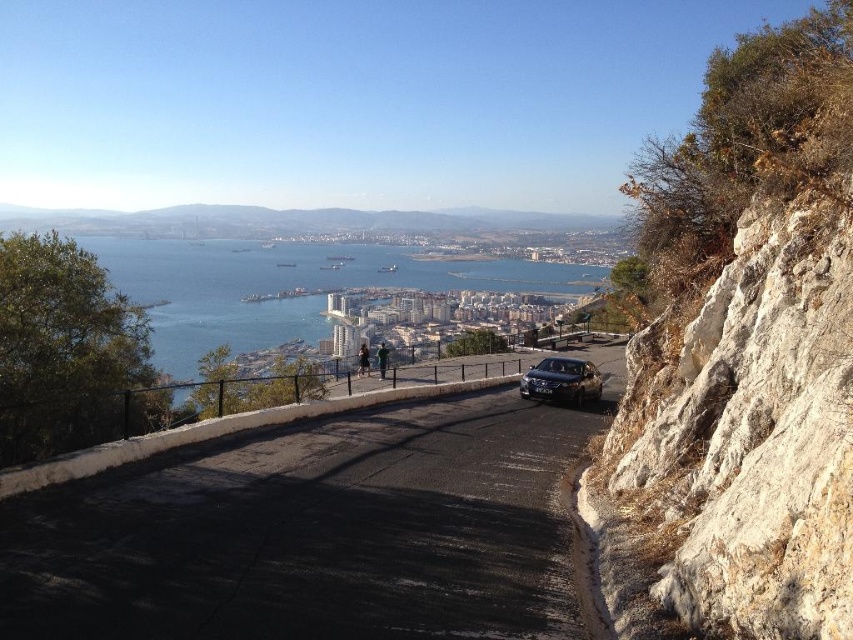
Which is behind, point (202, 278) or point (525, 397)?

Point (202, 278)

At what (x,y) coordinates should I click in order to perform the action: click on blue water at center. Please return your answer as a coordinate pair (x, y). The width and height of the screenshot is (853, 640). Looking at the image, I should click on (285, 288).

The width and height of the screenshot is (853, 640). What do you see at coordinates (285, 288) in the screenshot? I see `blue water at center` at bounding box center [285, 288].

You are a GUI agent. You are given a task and a screenshot of the screen. Output one action in this format:
    pyautogui.click(x=<x>, y=<y>)
    Task: Click on the blue water at center
    
    Given the screenshot: What is the action you would take?
    pyautogui.click(x=285, y=288)

Does white rocky cliff at right have a smaller size compared to blue water at center?

Indeed, white rocky cliff at right has a smaller size compared to blue water at center.

Does white rocky cliff at right have a lesser height compared to blue water at center?

Yes.

Is point (695, 451) positioned before point (383, 285)?

Yes, point (695, 451) is closer to viewer.

The height and width of the screenshot is (640, 853). I want to click on white rocky cliff at right, so click(x=740, y=444).

Does black asphalt road at center appear under blue water at center?

Yes.

What are the coordinates of `black asphalt road at center` in the screenshot? It's located at (318, 532).